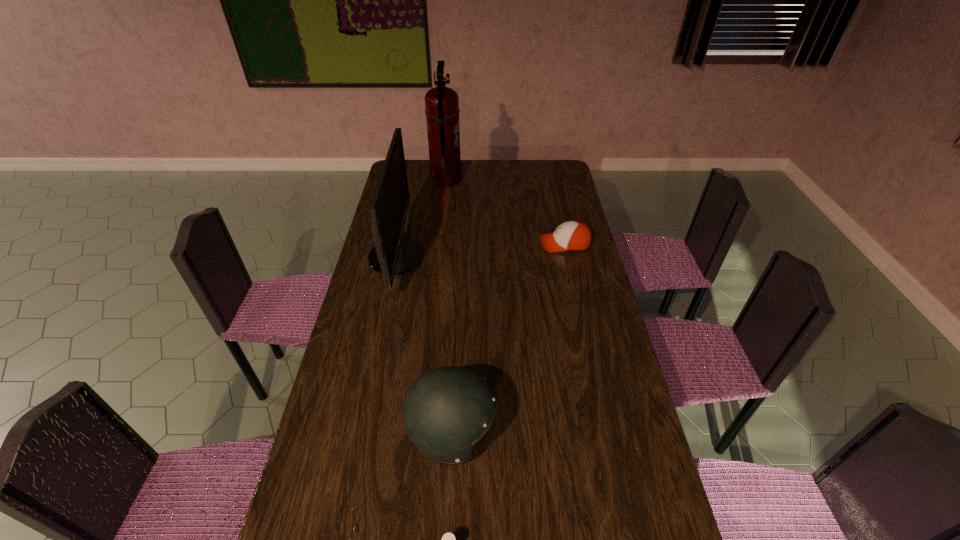
This screenshot has width=960, height=540. Identify the location of vacant space located on the front-facing side of the rightmost object. (516, 244).

Find the location of a particular element. The image size is (960, 540). vacant space located 0.130m on the front-facing side of the rightmost object is located at coordinates (506, 244).

Where is `vacant space located 0.210m on the front-facing side of the rightmost object`? This screenshot has height=540, width=960. vacant space located 0.210m on the front-facing side of the rightmost object is located at coordinates (486, 244).

In order to click on object that is at the far edge in this screenshot , I will do `click(442, 111)`.

Find the location of a particular element. The width and height of the screenshot is (960, 540). object positioned at the left edge is located at coordinates click(392, 255).

In order to click on object that is positioned at the right edge in this screenshot , I will do `click(575, 236)`.

Where is `vacant space at the far edge`? vacant space at the far edge is located at coordinates (484, 171).

Where is `free space at the left edge`? This screenshot has height=540, width=960. free space at the left edge is located at coordinates (323, 456).

Where is `vacant space at the right edge of the desktop`? vacant space at the right edge of the desktop is located at coordinates (577, 257).

In the image, there is a desktop. Where is `free space at the far right corner`? free space at the far right corner is located at coordinates tap(550, 180).